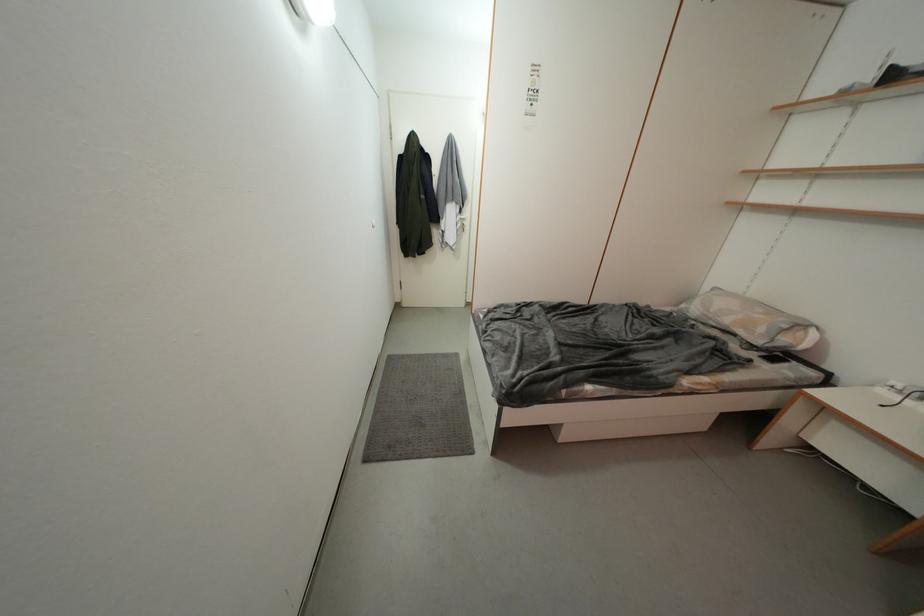
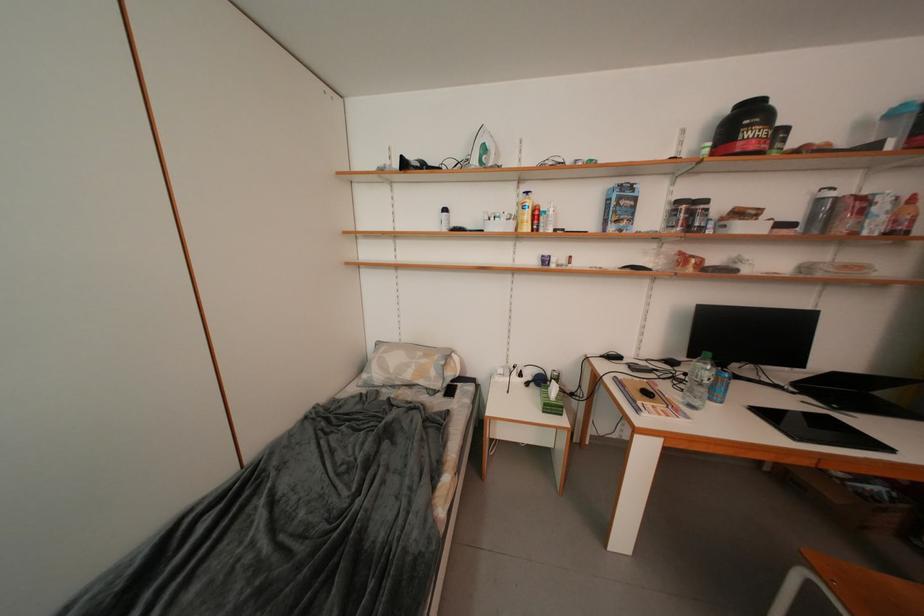
Question: Based on the continuous images, in which direction is the camera rotating? Reply with the corresponding letter.

Choices:
 (A) Left
 (B) Right
 (C) Up
 (D) Down

Answer: (B)